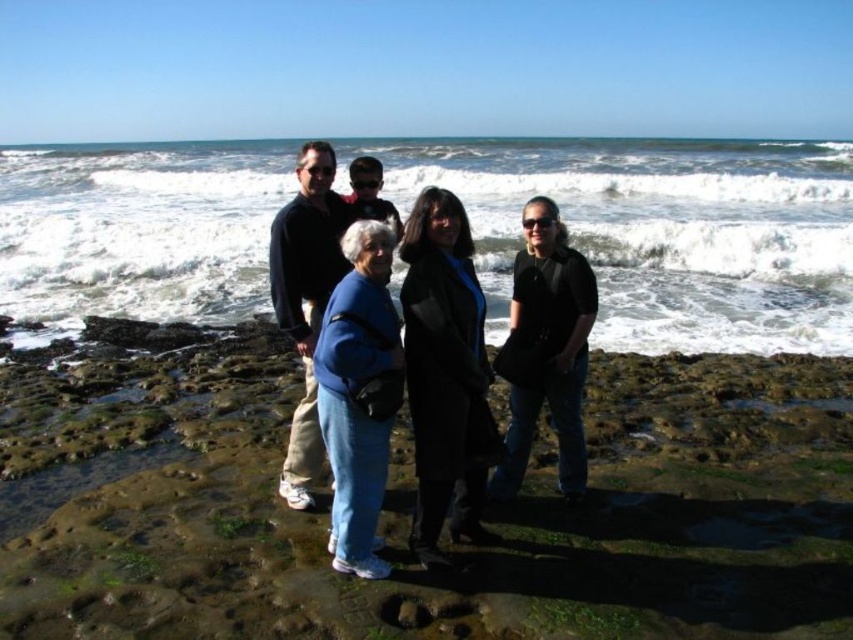
Question: Is green mossy rocks at center bigger than black matte jacket at center?

Choices:
 (A) no
 (B) yes

Answer: (B)

Question: Which of the following is the closest to the observer?

Choices:
 (A) black matte coat at center
 (B) white frothy wave at upper center
 (C) black matte jacket at center

Answer: (A)

Question: Where is white frothy wave at upper center located in relation to black matte coat at center in the image?

Choices:
 (A) left
 (B) right

Answer: (A)

Question: Is white frothy wave at upper center to the left of black matte coat at center from the viewer's perspective?

Choices:
 (A) no
 (B) yes

Answer: (B)

Question: Based on their relative distances, which object is farther from the white frothy wave at upper center?

Choices:
 (A) black matte jacket at center
 (B) green mossy rocks at center
 (C) blue denim jeans at center

Answer: (A)

Question: Which point is farther to the camera?

Choices:
 (A) (480, 346)
 (B) (366, 230)
 (C) (422, 282)
 (D) (271, 586)

Answer: (A)